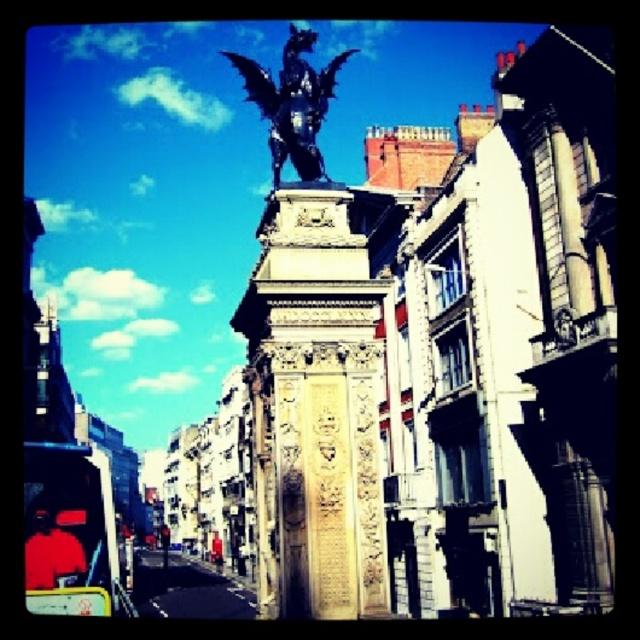
You are standing in the urban scene and want to take a photo of the black polished stone statue at center. If your camera has a maximum zoom range of 100 feet, can you capture the entire statue in your photo without moving closer?

The black polished stone statue at center is 195.32 feet away from the viewer. Since the camera can only zoom up to 100 feet, you cannot capture the entire statue without moving closer.

You are an urban planner assessing the central square. The black polished stone statue at center and the shiny black dragon at upper center are both important landmarks. Which of these two landmarks takes up more physical space in the square?

The shiny black dragon at upper center takes up more physical space in the square than the black polished stone statue at center, as it occupies a larger area according to the description.

You are a city planner assessing the urban layout. The city requires a new pedestrian walkway between the black polished stone statue at center and the shiny black dragon at upper center. The walkway must be at least 50 feet long to accommodate safety standards. Based on the scene description, will the proposed walkway meet the required length?

The black polished stone statue at center and shiny black dragon at upper center are 51.52 feet apart from each other, so the proposed walkway will meet the required length of at least 50 feet since 51.52 feet exceeds the minimum requirement.